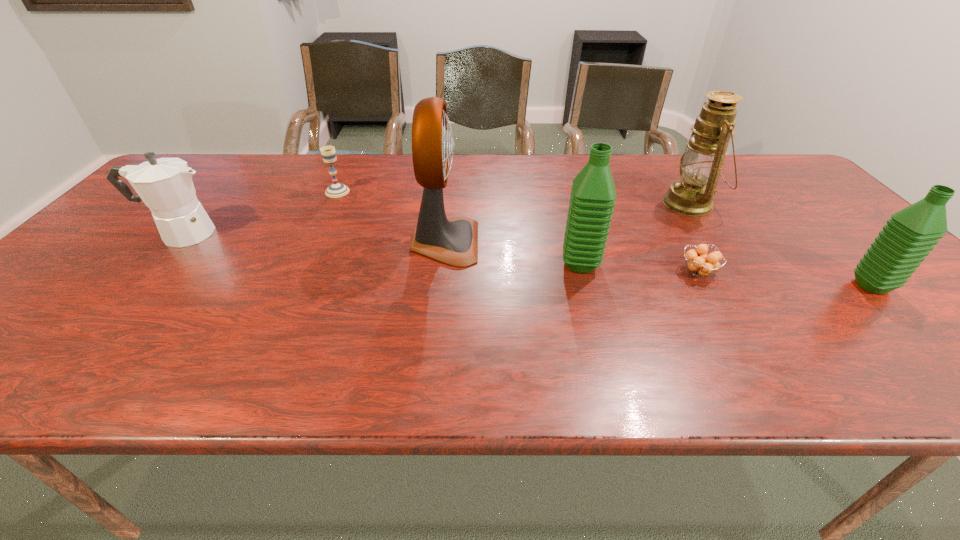
Locate an element on the screen. This screenshot has height=540, width=960. object at the right edge is located at coordinates (910, 234).

In order to click on vacant space at the far edge of the desktop in this screenshot , I will do `click(647, 169)`.

The image size is (960, 540). I want to click on vacant space at the near edge of the desktop, so click(x=868, y=334).

This screenshot has width=960, height=540. Identify the location of free space at the right edge of the desktop. (766, 199).

Where is `vacant position at the far left corner of the desktop`? This screenshot has width=960, height=540. vacant position at the far left corner of the desktop is located at coordinates (237, 153).

This screenshot has height=540, width=960. Identify the location of free space at the near right corner of the desktop. (944, 336).

In order to click on free space between the left water bottle and the fan in this screenshot , I will do `click(513, 253)`.

Where is `empty location between the orange fruit and the taller water bottle`? empty location between the orange fruit and the taller water bottle is located at coordinates (639, 268).

Identify the location of free space between the second shortest object and the orange fruit. (518, 232).

I want to click on free area in between the fan and the coffeepot, so click(x=313, y=238).